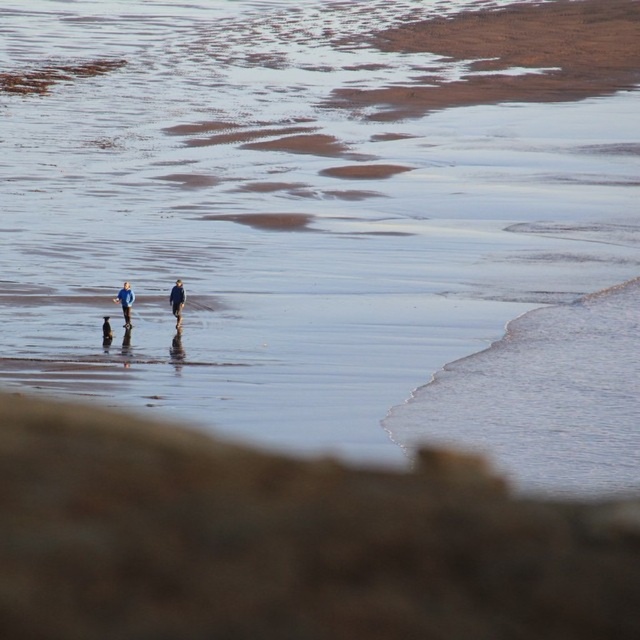
You are standing at the point with coordinates point (180,294) and want to walk to the point with coordinates point (122,292). Are you walking towards the foreground or the background of the image?

You are walking towards the foreground of the image because point (122,292) is in front of point (180,294).

You are standing on the brown sandy beach at lower center and looking towards the dark blue fabric at center. Which object is closer to you?

The brown sandy beach at lower center is closer to you than the dark blue fabric at center.